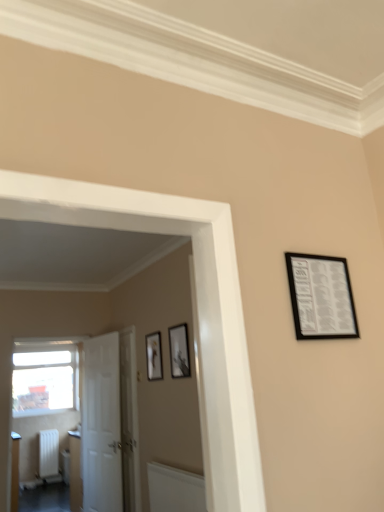
Question: Is matte white radiator at lower left closer to camera compared to white matte radiator at lower left?

Choices:
 (A) yes
 (B) no

Answer: (A)

Question: From a real-world perspective, is matte white radiator at lower left below white matte radiator at lower left?

Choices:
 (A) no
 (B) yes

Answer: (B)

Question: Are matte white radiator at lower left and white matte radiator at lower left beside each other?

Choices:
 (A) no
 (B) yes

Answer: (A)

Question: Is matte white radiator at lower left oriented away from white matte radiator at lower left?

Choices:
 (A) no
 (B) yes

Answer: (A)

Question: Is matte white radiator at lower left oriented towards white matte radiator at lower left?

Choices:
 (A) no
 (B) yes

Answer: (A)

Question: Considering the positions of white matte door at left, the 2th door from the right, and matte black picture frame at center, which is counted as the third picture frame, starting from the right, in the image, is white matte door at left, the 2th door from the right, wider or thinner than matte black picture frame at center, which is counted as the third picture frame, starting from the right,?

Choices:
 (A) wide
 (B) thin

Answer: (A)

Question: In terms of size, does white matte door at left, marked as the first door in a left-to-right arrangement, appear bigger or smaller than matte black picture frame at center, arranged as the 1th picture frame when viewed from the left?

Choices:
 (A) small
 (B) big

Answer: (B)

Question: From their relative heights in the image, would you say white matte door at left, marked as the first door in a left-to-right arrangement, is taller or shorter than matte black picture frame at center, which is counted as the third picture frame, starting from the right?

Choices:
 (A) short
 (B) tall

Answer: (B)

Question: Visually, is white matte door at left, the 2th door from the right, positioned to the left or to the right of matte black picture frame at center, which is counted as the third picture frame, starting from the right?

Choices:
 (A) right
 (B) left

Answer: (B)

Question: Considering their positions, is matte black picture frame at center, the third picture frame when ordered from top to bottom, located in front of or behind white glossy door at center, which is the 1th door in right-to-left order?

Choices:
 (A) front
 (B) behind

Answer: (A)

Question: Is matte black picture frame at center, the 1th picture frame in the bottom-to-top sequence, taller or shorter than white glossy door at center, arranged as the second door when viewed from the left?

Choices:
 (A) tall
 (B) short

Answer: (B)

Question: Does point pyautogui.click(x=152, y=371) appear closer or farther from the camera than point pyautogui.click(x=129, y=390)?

Choices:
 (A) farther
 (B) closer

Answer: (B)

Question: From a real-world perspective, is matte black picture frame at center, the third picture frame when ordered from top to bottom, physically located above or below white glossy door at center, arranged as the second door when viewed from the left?

Choices:
 (A) below
 (B) above

Answer: (B)

Question: Considering the positions of matte black picture frame at center, the 1th picture frame in the bottom-to-top sequence, and transparent glass window at left in the image, is matte black picture frame at center, the 1th picture frame in the bottom-to-top sequence, bigger or smaller than transparent glass window at left?

Choices:
 (A) big
 (B) small

Answer: (B)

Question: From a real-world perspective, is matte black picture frame at center, the 1th picture frame in the bottom-to-top sequence, above or below transparent glass window at left?

Choices:
 (A) above
 (B) below

Answer: (A)